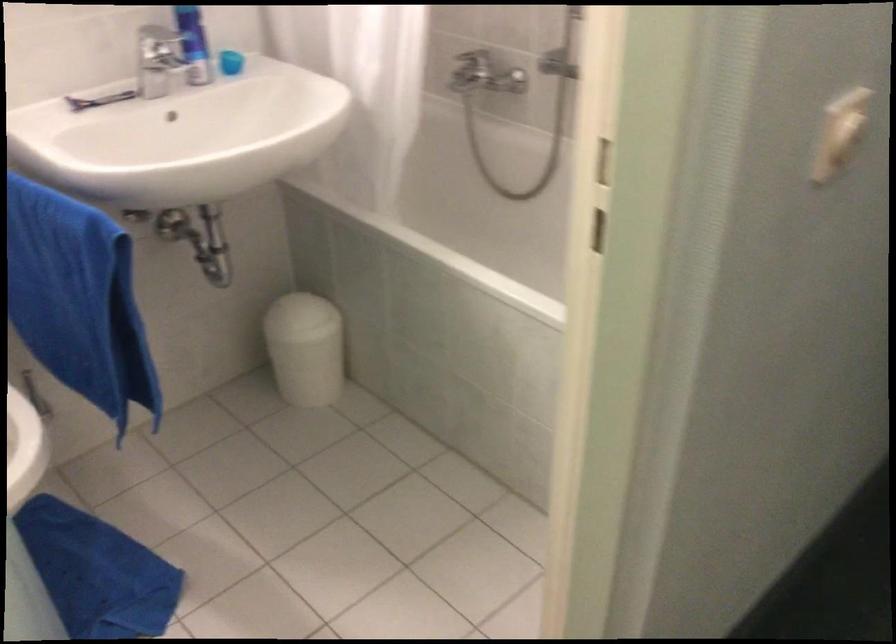
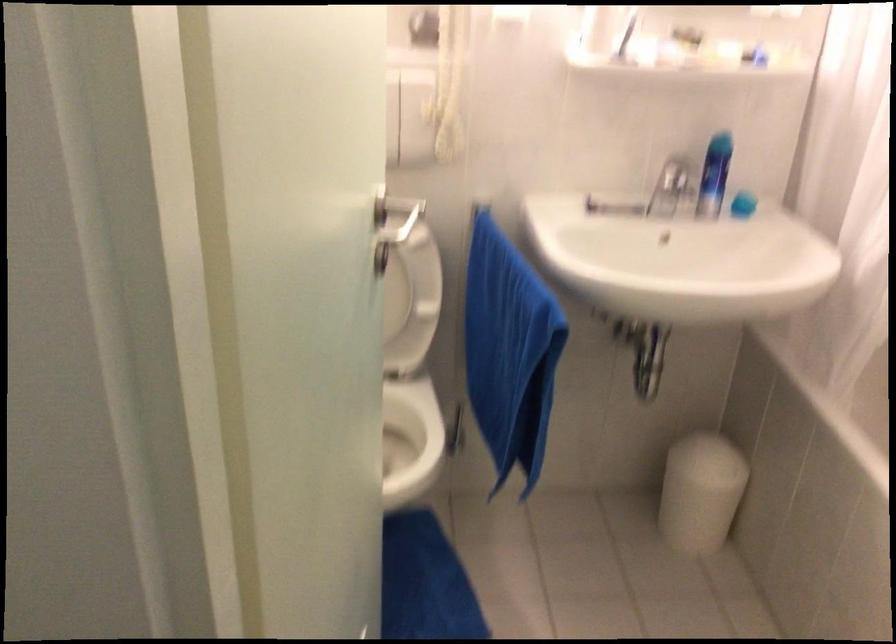
Question: The camera is either moving clockwise (left) or counter-clockwise (right) around the object. The first image is from the beginning of the video and the second image is from the end. Is the camera moving left or right when shooting the video?

Choices:
 (A) Left
 (B) Right

Answer: (B)